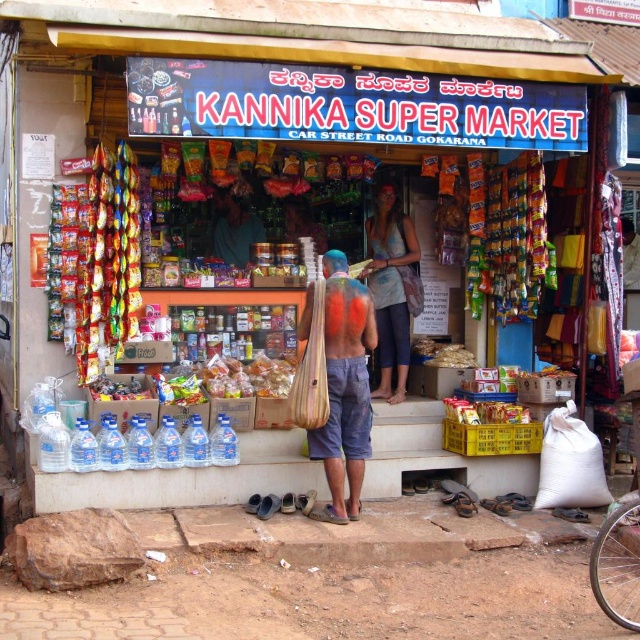
Question: Is striped fabric bag at center above matte plastic snack at center?

Choices:
 (A) no
 (B) yes

Answer: (B)

Question: Can you confirm if multicolored fabric bag at center is positioned to the right of shiny plastic bottle at lower left?

Choices:
 (A) yes
 (B) no

Answer: (A)

Question: Which point is closer to the camera?

Choices:
 (A) striped fabric bag at center
 (B) multicolored fabric bag at center
 (C) matte plastic snack at center

Answer: (A)

Question: Observing the image, what is the correct spatial positioning of striped fabric bag at center in reference to shiny plastic bottle at lower left?

Choices:
 (A) below
 (B) above

Answer: (B)

Question: Which of the following is the farthest from the observer?

Choices:
 (A) shiny plastic bottle at lower left
 (B) matte plastic snack at center

Answer: (B)

Question: Which of the following is the farthest from the observer?

Choices:
 (A) multicolored fabric bag at center
 (B) striped fabric bag at center

Answer: (A)